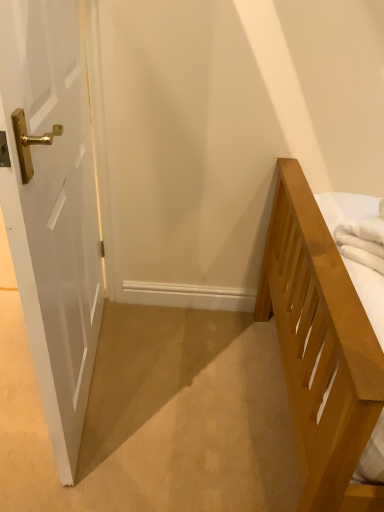
What do you see at coordinates (362, 242) in the screenshot? Image resolution: width=384 pixels, height=512 pixels. I see `white soft towel at right` at bounding box center [362, 242].

Locate an element on the screen. The height and width of the screenshot is (512, 384). white soft towel at right is located at coordinates (362, 242).

Identify the location of white glossy door at left. (52, 208).

Measure the distance between white glossy door at left and camera.

white glossy door at left and camera are 60.00 centimeters apart.

This screenshot has width=384, height=512. What do you see at coordinates (52, 208) in the screenshot?
I see `white glossy door at left` at bounding box center [52, 208].

Identify the location of white soft towel at right. The image size is (384, 512). (362, 242).

Considering the positions of objects white glossy door at left and white soft towel at right in the image provided, who is more to the right, white glossy door at left or white soft towel at right?

white soft towel at right is more to the right.

Is white glossy door at left behind white soft towel at right?

No, the depth of white glossy door at left is less than that of white soft towel at right.

Is point (65, 255) positioned before point (363, 234)?

That is True.

From the image's perspective, between white glossy door at left and white soft towel at right, who is located below?

white soft towel at right, from the image's perspective.

From a real-world perspective, is white glossy door at left positioned over white soft towel at right based on gravity?

No, from a real-world perspective, white glossy door at left is not above white soft towel at right.

Consider the image. Can you confirm if white glossy door at left is wider than white soft towel at right?

No, white glossy door at left is not wider than white soft towel at right.

Who is shorter, white glossy door at left or white soft towel at right?

white soft towel at right is shorter.

Who is smaller, white glossy door at left or white soft towel at right?

white soft towel at right is smaller.

Is white glossy door at left inside the boundaries of white soft towel at right, or outside?

white glossy door at left exists outside the volume of white soft towel at right.

Would you say white glossy door at left is a long distance from white soft towel at right?

No, white glossy door at left is not far away from white soft towel at right.

Is white glossy door at left facing towards white soft towel at right?

No, white glossy door at left is not facing towards white soft towel at right.

This screenshot has width=384, height=512. Identify the location of door located above the white soft towel at right (from the image's perspective). (52, 208).

Does white soft towel at right appear on the right side of white glossy door at left?

Correct, you'll find white soft towel at right to the right of white glossy door at left.

Is white soft towel at right in front of or behind white glossy door at left in the image?

white soft towel at right is positioned farther from the viewer than white glossy door at left.

Is point (366, 234) positioned before point (69, 44)?

No, it is not.

From the image's perspective, between white soft towel at right and white glossy door at left, which one is located above?

white glossy door at left.

From a real-world perspective, is white soft towel at right positioned above or below white glossy door at left?

white soft towel at right is situated higher than white glossy door at left in the real world.

Does white soft towel at right have a greater width compared to white glossy door at left?

Correct, the width of white soft towel at right exceeds that of white glossy door at left.

Does white soft towel at right have a lesser height compared to white glossy door at left?

Correct, white soft towel at right is not as tall as white glossy door at left.

Does white soft towel at right have a larger size compared to white glossy door at left?

Actually, white soft towel at right might be smaller than white glossy door at left.

Would you say white soft towel at right is outside white glossy door at left?

Yes, white soft towel at right is not within white glossy door at left.

Is white soft towel at right directly adjacent to white glossy door at left?

There is a gap between white soft towel at right and white glossy door at left.

Does white soft towel at right turn towards white glossy door at left?

No, white soft towel at right is not oriented towards white glossy door at left.

Can you tell me how much white soft towel at right and white glossy door at left differ in facing direction?

The facing directions of white soft towel at right and white glossy door at left are 27.2 degrees apart.

At what (x,y) coordinates should I click in order to perform the action: click on door above the white soft towel at right (from the image's perspective). Please return your answer as a coordinate pair (x, y). Image resolution: width=384 pixels, height=512 pixels. Looking at the image, I should click on coord(52,208).

Find the location of `bath towel positioned vertically above the white glossy door at left (from a real-world perspective)`. bath towel positioned vertically above the white glossy door at left (from a real-world perspective) is located at coordinates (362, 242).

In the image, there is a white glossy door at left. At what (x,y) coordinates should I click in order to perform the action: click on bath towel below it (from the image's perspective). Please return your answer as a coordinate pair (x, y). Looking at the image, I should click on (362, 242).